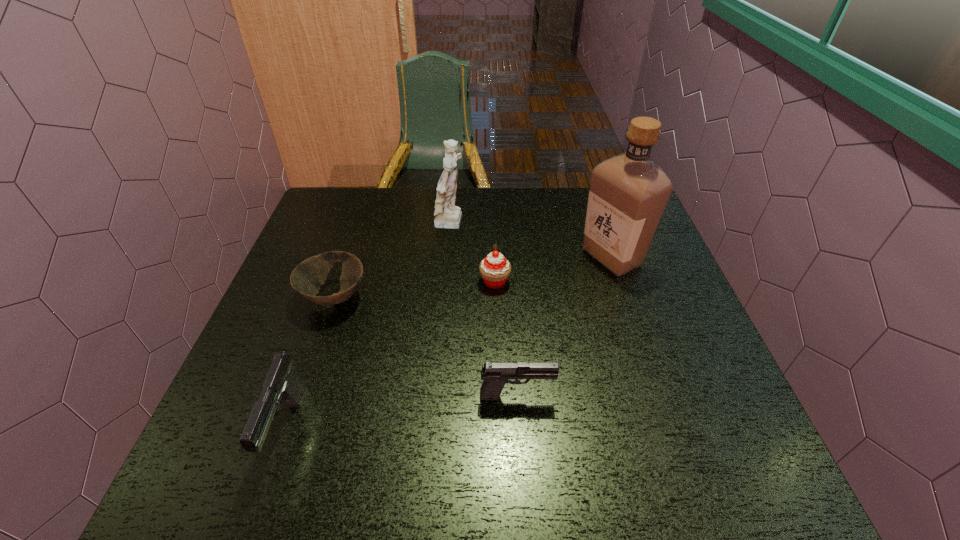
The height and width of the screenshot is (540, 960). I want to click on object that is at the near left corner, so click(281, 384).

In the image, there is a desktop. Where is `vacant area at the far edge`? The height and width of the screenshot is (540, 960). vacant area at the far edge is located at coordinates (575, 202).

At what (x,y) coordinates should I click in order to perform the action: click on free point at the near edge. Please return your answer as a coordinate pair (x, y). Image resolution: width=960 pixels, height=540 pixels. Looking at the image, I should click on (491, 405).

Where is `vacant space at the left edge`? The width and height of the screenshot is (960, 540). vacant space at the left edge is located at coordinates (334, 285).

The image size is (960, 540). Find the location of `vacant region at the right edge of the desktop`. vacant region at the right edge of the desktop is located at coordinates (651, 251).

In the image, there is a desktop. Identify the location of vacant space at the far left corner. (359, 198).

This screenshot has height=540, width=960. Find the location of `vacant space at the near right corner of the desktop`. vacant space at the near right corner of the desktop is located at coordinates (735, 429).

Find the location of a particular element. This screenshot has height=540, width=960. vacant area between the bowl and the rightmost object is located at coordinates (473, 277).

Locate an element on the screen. The height and width of the screenshot is (540, 960). free space between the bowl and the cupcake is located at coordinates (415, 289).

This screenshot has width=960, height=540. Identify the location of empty location between the second tallest object and the right pistol. (484, 310).